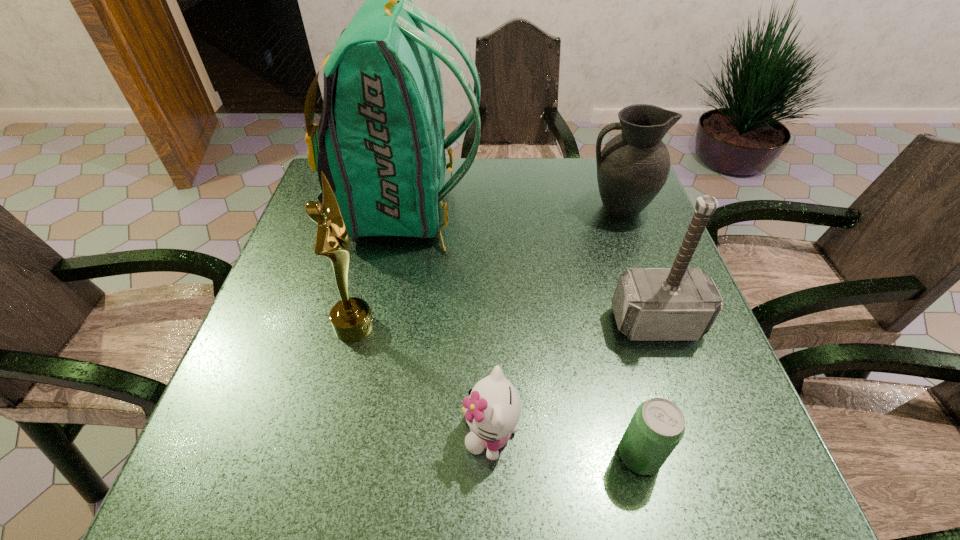
Where is `the tallest object`? the tallest object is located at coordinates (380, 142).

Locate an element on the screen. award is located at coordinates (351, 318).

Where is `hammer`? hammer is located at coordinates pyautogui.click(x=650, y=304).

The height and width of the screenshot is (540, 960). I want to click on the third shortest object, so 632,168.

At what (x,y) coordinates should I click in order to perform the action: click on kitten. Please return your answer as a coordinate pair (x, y). Looking at the image, I should click on (492, 409).

Identify the location of soda. Image resolution: width=960 pixels, height=540 pixels. (658, 425).

Identify the location of blank space located 0.360m on the back of the backpack. This screenshot has height=540, width=960. (614, 208).

Locate an element on the screen. The image size is (960, 540). vacant point located 0.220m on the front-facing side of the award is located at coordinates (481, 326).

Find the location of a particular element. free spot located 0.190m for striking with the head of the hammer is located at coordinates (696, 438).

The width and height of the screenshot is (960, 540). Identify the location of vacant region located 0.270m on the side of the third shortest object with the handle. (483, 208).